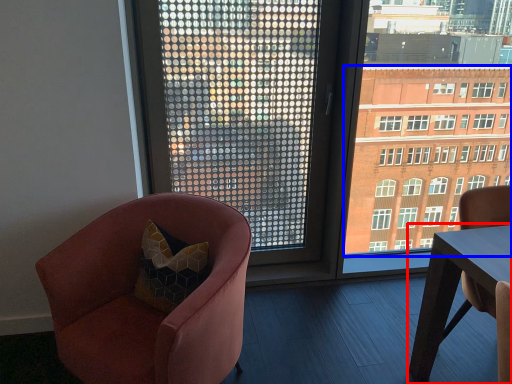
Question: Which of the following is the farthest to the observer, table (highlighted by a red box) or condominium (highlighted by a blue box)?

Choices:
 (A) table
 (B) condominium

Answer: (B)